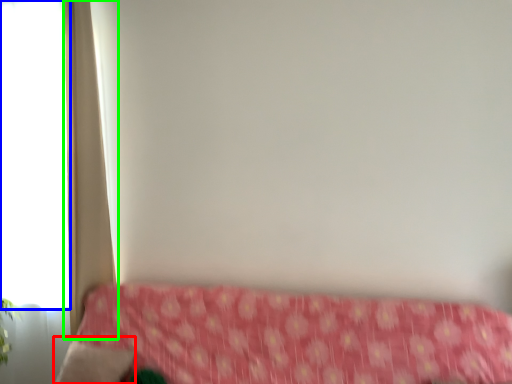
Question: Considering the real-world distances, which object is farthest from pillow (highlighted by a red box)? window (highlighted by a blue box) or curtain (highlighted by a green box)?

Choices:
 (A) window
 (B) curtain

Answer: (A)